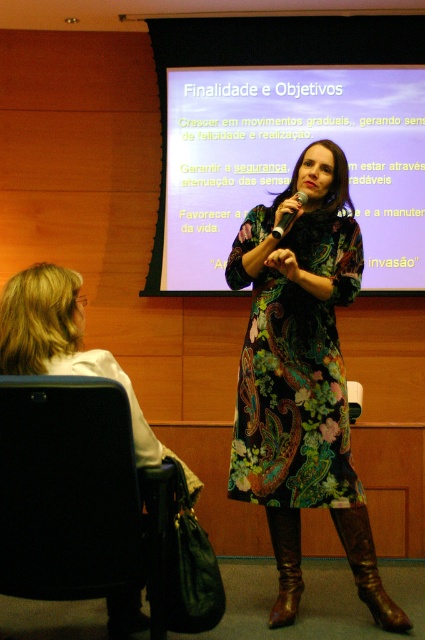
Does point (45, 448) lie in front of point (280, 221)?

Yes.

Does black leather chair at lower left have a greater width compared to matte black microphone at center?

Indeed, black leather chair at lower left has a greater width compared to matte black microphone at center.

Describe the element at coordinates (68, 492) in the screenshot. I see `black leather chair at lower left` at that location.

At what (x,y) coordinates should I click in order to perform the action: click on black leather chair at lower left. Please return your answer as a coordinate pair (x, y). The width and height of the screenshot is (425, 640). Looking at the image, I should click on 68,492.

Does black leather chair at lower left have a lesser height compared to brown leather boot at lower right?

In fact, black leather chair at lower left may be taller than brown leather boot at lower right.

Locate an element on the screen. This screenshot has width=425, height=640. black leather chair at lower left is located at coordinates click(x=68, y=492).

Measure the distance between black leather chair at lower left and camera.

black leather chair at lower left is 6.24 feet away from camera.

Find the location of a particular element. black leather chair at lower left is located at coordinates (68, 492).

Can you confirm if floral-patterned dress at center is positioned to the left of black leather chair at lower left?

In fact, floral-patterned dress at center is to the right of black leather chair at lower left.

Is point (266, 305) in front of point (130, 477)?

No.

This screenshot has height=640, width=425. What do you see at coordinates (302, 378) in the screenshot?
I see `floral-patterned dress at center` at bounding box center [302, 378].

Locate an element on the screen. floral-patterned dress at center is located at coordinates (302, 378).